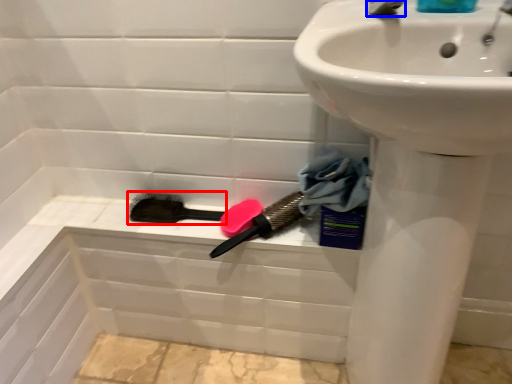
Question: Which object is further to the camera taking this photo, brush (highlighted by a red box) or tap (highlighted by a blue box)?

Choices:
 (A) brush
 (B) tap

Answer: (A)